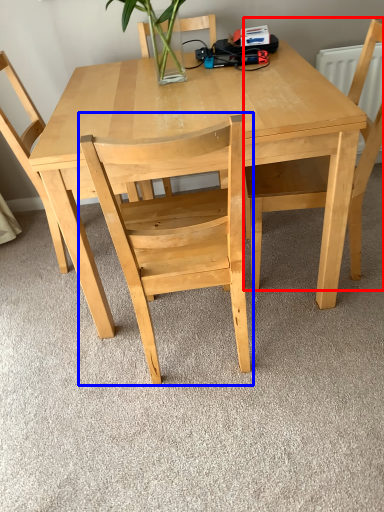
Question: Which of the following is the closest to the observer, chair (highlighted by a red box) or chair (highlighted by a blue box)?

Choices:
 (A) chair
 (B) chair

Answer: (B)